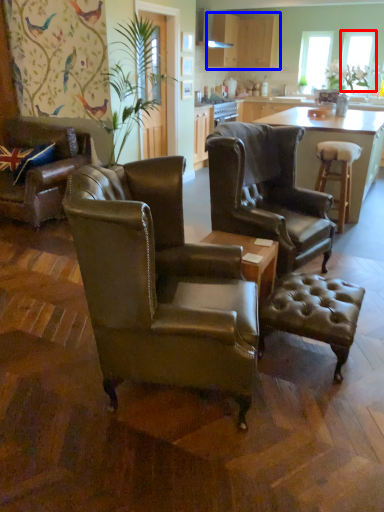
Question: Which object appears closest to the camera in this image, window screen (highlighted by a red box) or cabinetry (highlighted by a blue box)?

Choices:
 (A) window screen
 (B) cabinetry

Answer: (B)